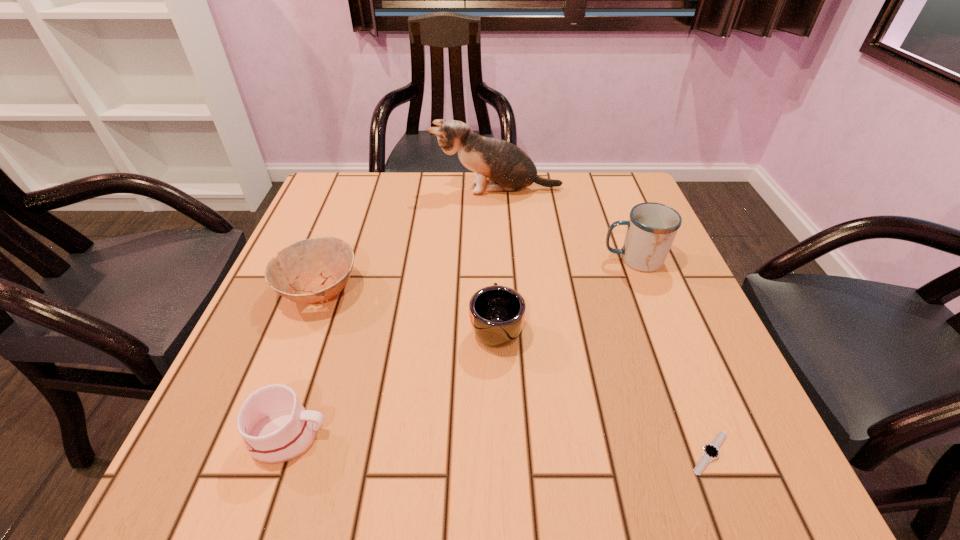
Locate an element on the screen. The width and height of the screenshot is (960, 540). the tallest object is located at coordinates (509, 168).

Identify the location of the farthest object. (509, 168).

Image resolution: width=960 pixels, height=540 pixels. Identify the location of the rightmost mug. (652, 227).

Where is `the farthest mug`? This screenshot has width=960, height=540. the farthest mug is located at coordinates (652, 227).

In order to click on the second nearest mug in this screenshot , I will do [497, 313].

Where is `bowl`? bowl is located at coordinates (323, 265).

What are the coordinates of `the nearest mug` in the screenshot? It's located at (276, 428).

The width and height of the screenshot is (960, 540). I want to click on watch, so click(710, 452).

You are a GUI agent. You are given a task and a screenshot of the screen. Output one action in this format:
    pyautogui.click(x=<x>, y=<y>)
    Task: Click on the vacant space located 0.200m at the face of the farthest object
    
    Given the screenshot: What is the action you would take?
    pyautogui.click(x=359, y=190)

You are a GUI agent. You are given a task and a screenshot of the screen. Output one action in this format:
    pyautogui.click(x=<x>, y=<y>)
    Task: Click on the free space located at the face of the farthest object
    This screenshot has height=540, width=960.
    Given the screenshot: What is the action you would take?
    pyautogui.click(x=385, y=190)